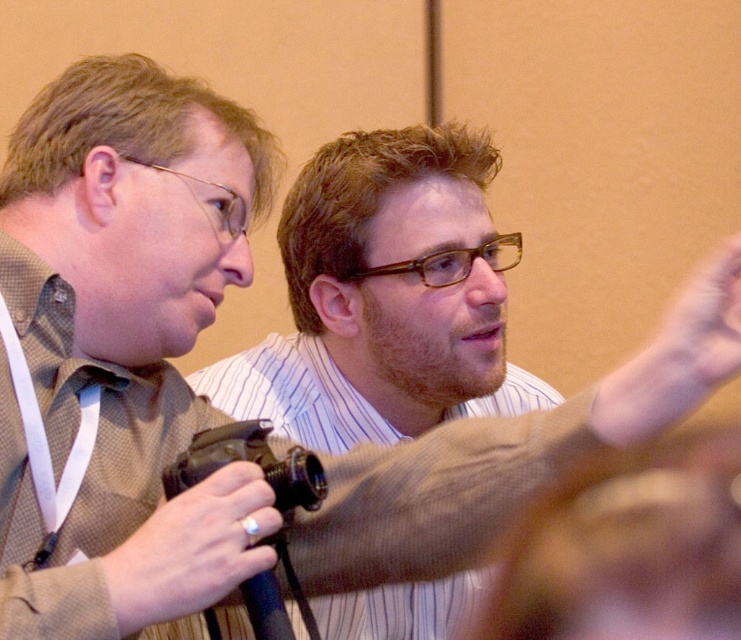
Does brown leather belt at center lie in front of smooth skin hand at upper right?

That is True.

Based on the photo, is brown leather belt at center smaller than smooth skin hand at upper right?

Incorrect, brown leather belt at center is not smaller in size than smooth skin hand at upper right.

Who is more forward, (545, 586) or (728, 301)?

Positioned in front is point (545, 586).

The image size is (741, 640). Find the location of `brown leather belt at center`. brown leather belt at center is located at coordinates (628, 547).

Which is in front, point (167, 589) or point (697, 323)?

Positioned in front is point (697, 323).

Is point (222, 563) in front of point (724, 292)?

No, it is behind (724, 292).

Does point (259, 499) come closer to viewer compared to point (662, 384)?

No, (259, 499) is behind (662, 384).

The width and height of the screenshot is (741, 640). Find the location of `silver metallic ring at lower left`. silver metallic ring at lower left is located at coordinates (192, 548).

This screenshot has height=640, width=741. Describe the element at coordinates (126, 330) in the screenshot. I see `matte brown camera at left` at that location.

Measure the distance between matte brown camera at left and camera.

matte brown camera at left is 25.53 inches away from camera.

The height and width of the screenshot is (640, 741). I want to click on matte brown camera at left, so click(x=126, y=330).